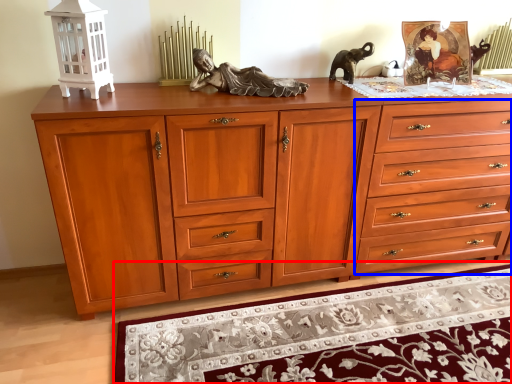
Question: Which point is closer to the camera, mat (highlighted by a red box) or drawer (highlighted by a blue box)?

Choices:
 (A) mat
 (B) drawer

Answer: (A)